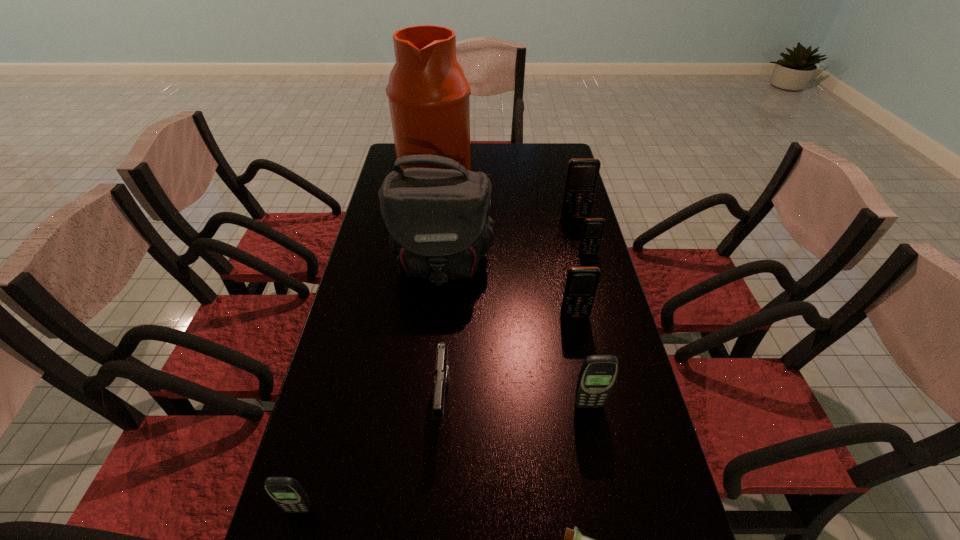
The width and height of the screenshot is (960, 540). I want to click on vacant area that lies between the second smallest orange cellular telephone and the pistol, so click(x=509, y=359).

The width and height of the screenshot is (960, 540). I want to click on blank region between the nearer gray cellular telephone and the shoulder bag, so click(370, 387).

Where is `empty space between the second farthest cellular telephone and the pistol`? This screenshot has height=540, width=960. empty space between the second farthest cellular telephone and the pistol is located at coordinates coord(516,328).

Identify the location of blank region between the orange water jug and the smaller gray cellular telephone. Image resolution: width=960 pixels, height=540 pixels. (368, 345).

Image resolution: width=960 pixels, height=540 pixels. In order to click on vacant area that lies between the pistol and the shoulder bag in this screenshot , I will do `click(443, 333)`.

At what (x,y) coordinates should I click in order to perform the action: click on object that stands as the eighth closest to the second biggest orange cellular telephone. Please return your answer as a coordinate pair (x, y). The image size is (960, 540). Looking at the image, I should click on (286, 492).

Select which object appears as the fourth closest to the water jug. Please provide its 2D coordinates. Your answer should be formatted as a tuple, i.e. [(x, y)], where the tuple contains the x and y coordinates of a point satisfying the conditions above.

[(581, 284)]

Where is `cellular telephone that stands as the second closest to the tallest cellular telephone`? This screenshot has width=960, height=540. cellular telephone that stands as the second closest to the tallest cellular telephone is located at coordinates (581, 284).

Where is `the second closest cellular telephone to the right gray cellular telephone`? The width and height of the screenshot is (960, 540). the second closest cellular telephone to the right gray cellular telephone is located at coordinates (593, 228).

Locate an element on the screen. The width and height of the screenshot is (960, 540). orange cellular telephone that stands as the third closest to the farther gray cellular telephone is located at coordinates (582, 174).